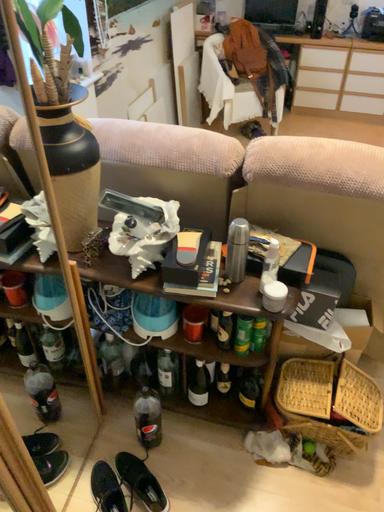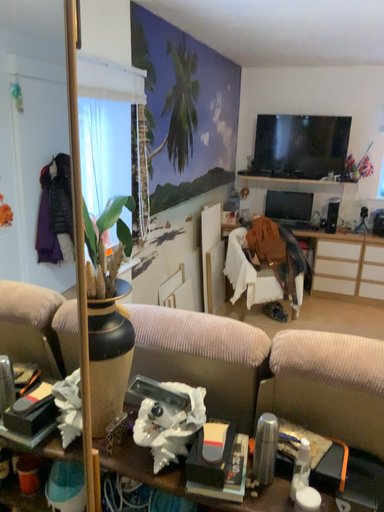
Question: How did the camera likely rotate when shooting the video?

Choices:
 (A) rotated downward
 (B) rotated upward

Answer: (B)